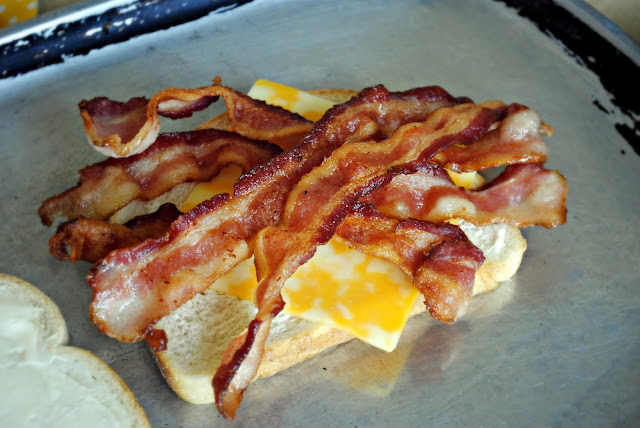
The height and width of the screenshot is (428, 640). Find the location of `black part of baking sheet`. black part of baking sheet is located at coordinates coord(145,15), coord(589,48).